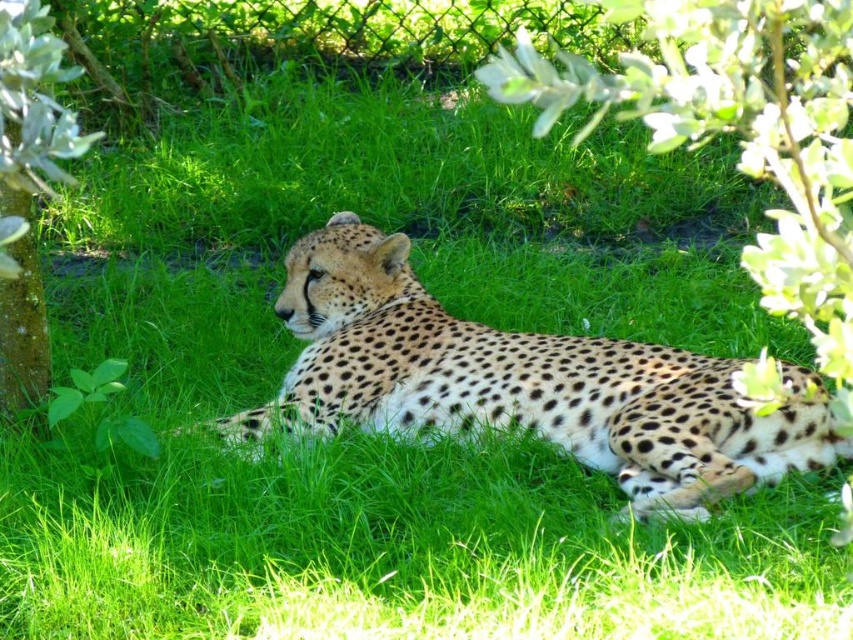
You are a zookeeper observing the spotted fur cheetah at center and the green leafy bush at left. Which object is closer to your viewpoint?

The spotted fur cheetah at center is closer to the viewer than the green leafy bush at left.

You are a wildlife photographer trying to capture a photo of the spotted fur cheetah at center and the green leafy bush at left. Based on their sizes in the image, which one do you think is wider?

The spotted fur cheetah at center might be wider than green leafy bush at left according to the description.